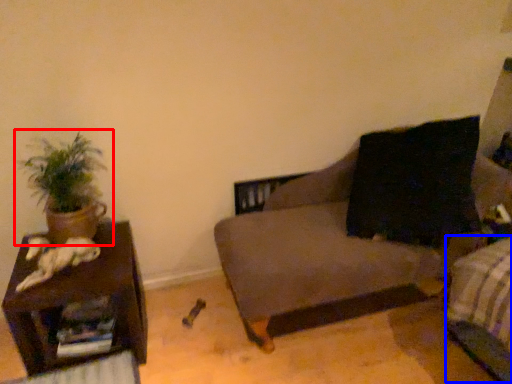
Question: Among these objects, which one is nearest to the camera, houseplant (highlighted by a red box) or bed frame (highlighted by a blue box)?

Choices:
 (A) houseplant
 (B) bed frame

Answer: (B)